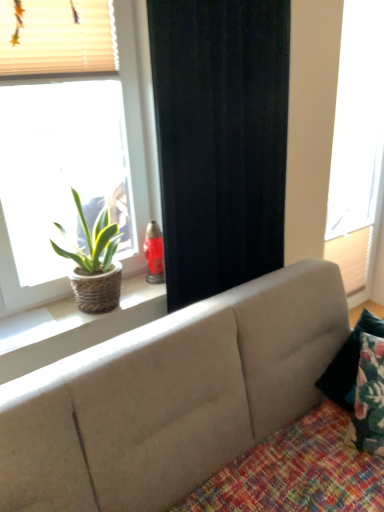
Question: Is multicolored woven quilt at lower right in front of or behind beige fabric blinds at upper left in the image?

Choices:
 (A) front
 (B) behind

Answer: (A)

Question: Looking at the image, does multicolored woven quilt at lower right seem bigger or smaller compared to beige fabric blinds at upper left?

Choices:
 (A) small
 (B) big

Answer: (B)

Question: Which object is positioned farthest from the white matte window at right, placed as the 1th window when sorted from right to left?

Choices:
 (A) beige fabric blinds at upper left
 (B) floral fabric pillow at lower right
 (C) multicolored woven quilt at lower right
 (D) black fabric curtain at center
 (E) matte wicker basket at left, arranged as the first window when viewed from the left

Answer: (A)

Question: Estimate the real-world distances between objects in this image. Which object is farther from the multicolored woven quilt at lower right?

Choices:
 (A) black fabric curtain at center
 (B) floral fabric pillow at lower right
 (C) natural wood window sill at upper left
 (D) beige fabric couch at center
 (E) matte wicker basket at left, which is counted as the 2th window, starting from the right

Answer: (E)